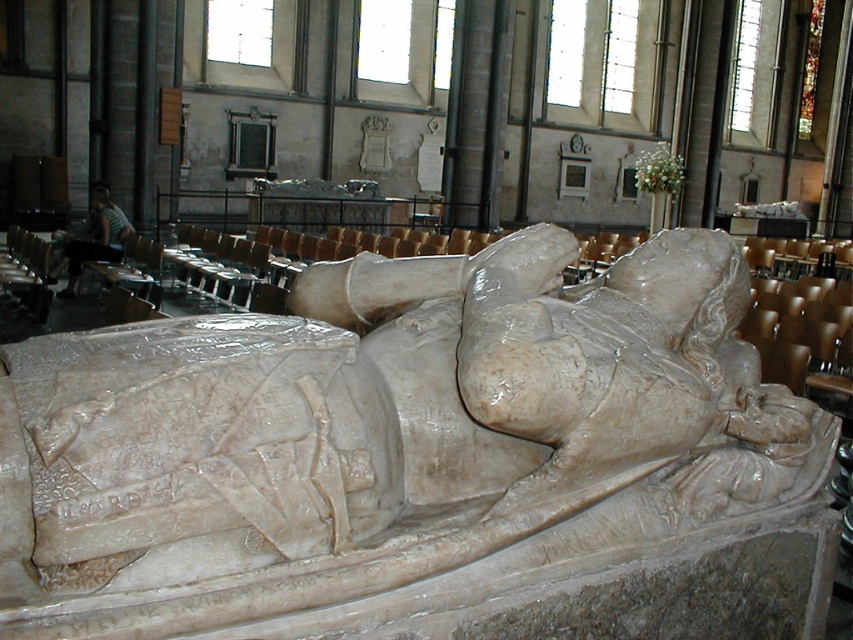
You are standing at the entrance of the cathedral and notice a point marked at coordinates (419, 460). Which object does this point belong to?

The point at coordinates (419, 460) is on the white marble statue at center.

You are standing in the cathedral and want to take a photo of the white marble statue at center. If your camera has a maximum focus range of 8 feet, will you need to move closer to capture a clear image?

The white marble statue at center is 8.89 feet away from the camera. Since the statue is beyond the camera maximum focus range of 8 feet, you need to move closer to capture a clear image.

You are standing in the cathedral and want to take a photo of both the white marble statue at center and the light brown wooden chair at lower left. Which object should you focus on first to ensure both are in clear view?

You should focus on the white marble statue at center first because it is closer to you than the light brown wooden chair at lower left, so adjusting focus from near to far will help both be in clear view.